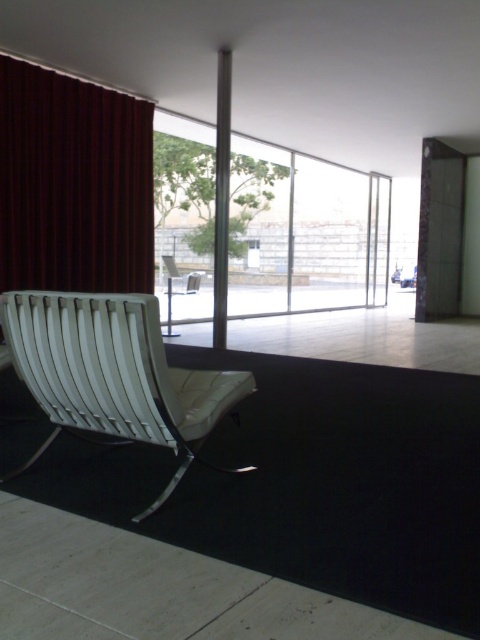
Locate an element on the screen. dark red velvet curtain at left is located at coordinates (72, 182).

Can you confirm if dark red velvet curtain at left is bigger than metallic silver chair at center?

No.

Identify the location of dark red velvet curtain at left. (72, 182).

At what (x,y) coordinates should I click in order to perform the action: click on dark red velvet curtain at left. Please return your answer as a coordinate pair (x, y). The width and height of the screenshot is (480, 640). Looking at the image, I should click on (72, 182).

Between point (144, 292) and point (186, 280), which one is positioned behind?

Point (186, 280)

Does white leather armchair at left lie in front of metallic silver chair at center?

Yes, it is.

Does point (194, 435) come behind point (190, 284)?

No, (194, 435) is closer to viewer.

At what (x,y) coordinates should I click in order to perform the action: click on white leather armchair at left. Please return your answer as a coordinate pair (x, y). Looking at the image, I should click on (113, 371).

Find the location of `dark red velvet curtain at left`. dark red velvet curtain at left is located at coordinates coord(72,182).

Does dark red velvet curtain at left appear under white leather armchair at left?

Actually, dark red velvet curtain at left is above white leather armchair at left.

Who is more forward, (82, 284) or (188, 392)?

Positioned in front is point (188, 392).

You are a GUI agent. You are given a task and a screenshot of the screen. Output one action in this format:
    pyautogui.click(x=<x>, y=<y>)
    Task: Click on the dark red velvet curtain at left
    This screenshot has width=480, height=640.
    Given the screenshot: What is the action you would take?
    tap(72, 182)